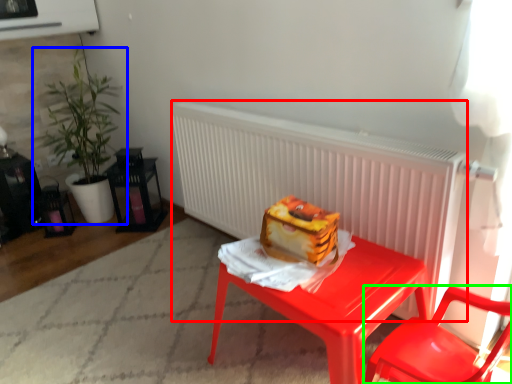
Question: Which object is the closest to the radiator (highlighted by a red box)? Choose among these: houseplant (highlighted by a blue box) or chair (highlighted by a green box).

Choices:
 (A) houseplant
 (B) chair

Answer: (B)